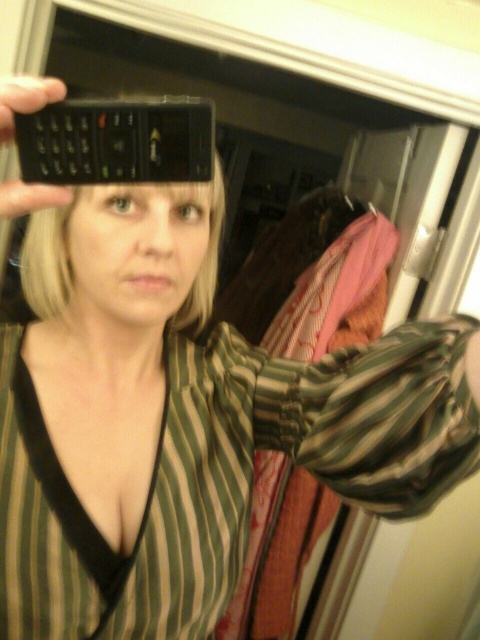
Question: Which point is closer to the camera?

Choices:
 (A) (54, 106)
 (B) (0, 115)

Answer: (B)

Question: Can you confirm if black matte phone at upper center is smaller than black matte phone at upper left?

Choices:
 (A) yes
 (B) no

Answer: (B)

Question: Is black matte phone at upper center positioned in front of black matte phone at upper left?

Choices:
 (A) yes
 (B) no

Answer: (B)

Question: Observing the image, what is the correct spatial positioning of black matte phone at upper center in reference to black matte phone at upper left?

Choices:
 (A) left
 (B) right

Answer: (B)

Question: Among these points, which one is nearest to the camera?

Choices:
 (A) (9, 113)
 (B) (186, 154)

Answer: (A)